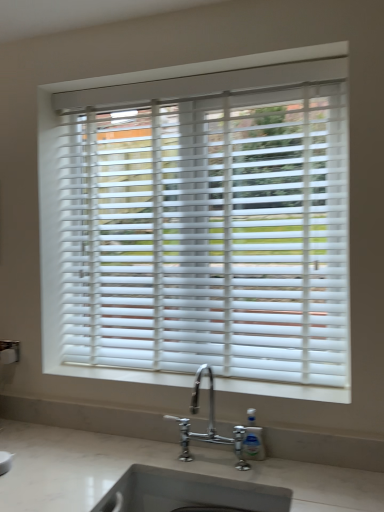
I want to click on vacant region below chrome metallic faucet at lower center (from a real-world perspective), so [x=216, y=462].